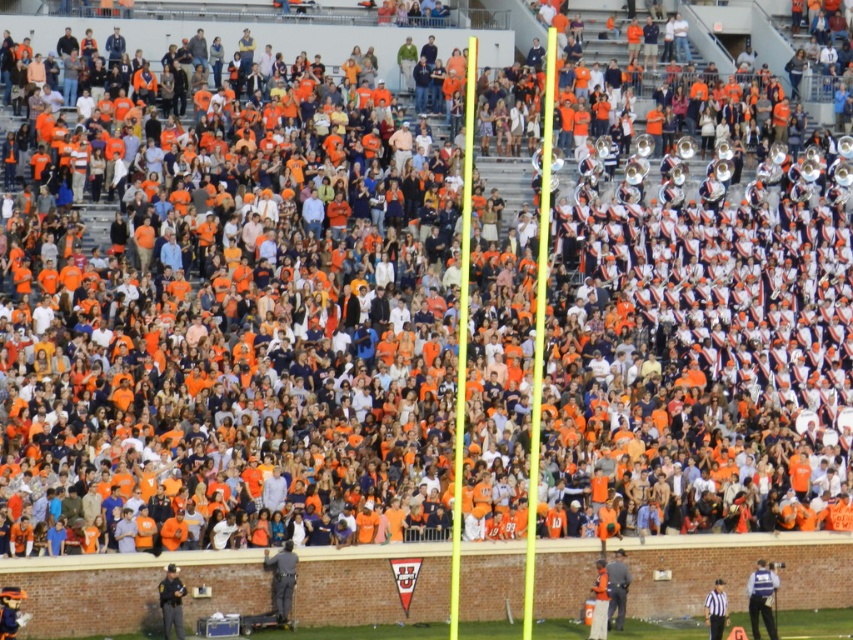
Which of these two, blue uniform at center or gray fabric jacket at lower right, stands taller?

Standing taller between the two is gray fabric jacket at lower right.

Does blue uniform at center appear under gray fabric jacket at lower right?

Yes.

Is point (759, 573) farther from camera compared to point (618, 625)?

Yes.

Find the location of a particular element. The width and height of the screenshot is (853, 640). blue uniform at center is located at coordinates (761, 598).

Which is above, gray fabric jacket at lower right or striped fabric referee at lower right?

Positioned higher is gray fabric jacket at lower right.

Which of these two, gray fabric jacket at lower right or striped fabric referee at lower right, stands taller?

gray fabric jacket at lower right

In the scene shown: Who is more distant from viewer, (628, 579) or (703, 609)?

Positioned behind is point (703, 609).

Where is `gray fabric jacket at lower right`? This screenshot has width=853, height=640. gray fabric jacket at lower right is located at coordinates (618, 588).

This screenshot has width=853, height=640. Find the location of `blue uniform at center`. blue uniform at center is located at coordinates coord(761,598).

Is point (758, 568) less distant than point (709, 628)?

No, (758, 568) is further to viewer.

Where is `blue uniform at center`? Image resolution: width=853 pixels, height=640 pixels. blue uniform at center is located at coordinates (761, 598).